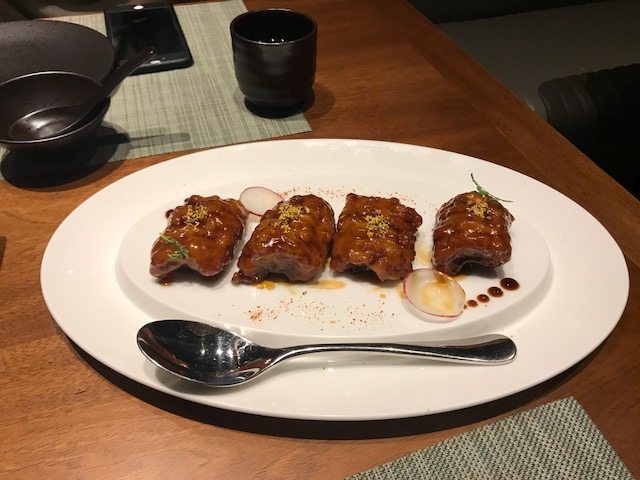
Locate an element on the screen. edge of white plate is located at coordinates (76, 292), (394, 387), (592, 285), (352, 153).